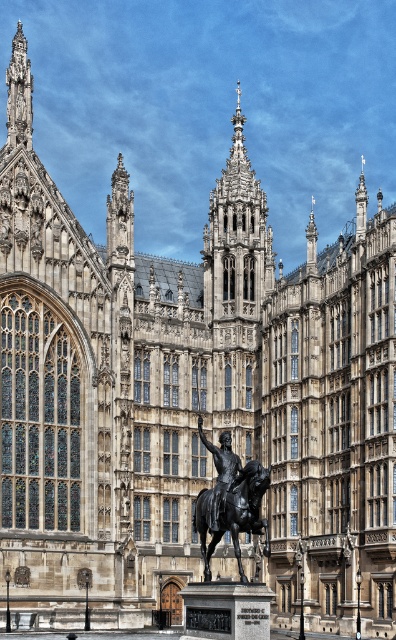
Question: Which object is farther from the camera taking this photo?

Choices:
 (A) stone gothic tower at center
 (B) polished bronze horse at center

Answer: (A)

Question: Does stone gothic tower at center appear over polished bronze horse at center?

Choices:
 (A) yes
 (B) no

Answer: (A)

Question: Is stone gothic tower at center positioned behind polished bronze horse at center?

Choices:
 (A) yes
 (B) no

Answer: (A)

Question: Is stone gothic tower at center smaller than polished bronze horse at center?

Choices:
 (A) yes
 (B) no

Answer: (B)